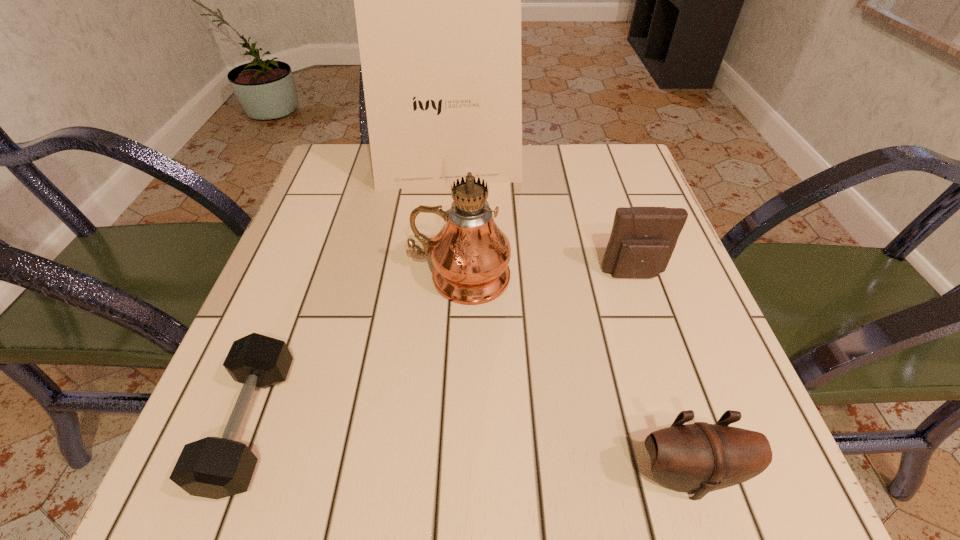
Locate an element on the screen. free space located on the back of the oil lamp is located at coordinates coord(464,199).

Where is `vacant space located 0.180m with an open flap on the third shortest object`? Image resolution: width=960 pixels, height=540 pixels. vacant space located 0.180m with an open flap on the third shortest object is located at coordinates (665, 367).

Where is `blank area located 0.310m on the back of the shortest object`? The image size is (960, 540). blank area located 0.310m on the back of the shortest object is located at coordinates (324, 234).

Find the location of a particular element. object situated at the far edge is located at coordinates (427, 0).

At what (x,y) coordinates should I click in order to perform the action: click on pouch that is at the near edge. Please return your answer as a coordinate pair (x, y). The height and width of the screenshot is (540, 960). Looking at the image, I should click on (698, 458).

You are a GUI agent. You are given a task and a screenshot of the screen. Output one action in this format:
    pyautogui.click(x=<x>, y=<y>)
    Task: Click on the dumbbell positioned at the near edge
    The width and height of the screenshot is (960, 540).
    Given the screenshot: What is the action you would take?
    pyautogui.click(x=212, y=467)

Where is `shopping bag present at the left edge`? This screenshot has width=960, height=540. shopping bag present at the left edge is located at coordinates (427, 0).

Image resolution: width=960 pixels, height=540 pixels. Find the location of `dumbbell located at the left edge`. dumbbell located at the left edge is located at coordinates (212, 467).

Where is `object located at the far left corner`? object located at the far left corner is located at coordinates (427, 0).

Where is `object present at the near left corner`? object present at the near left corner is located at coordinates (212, 467).